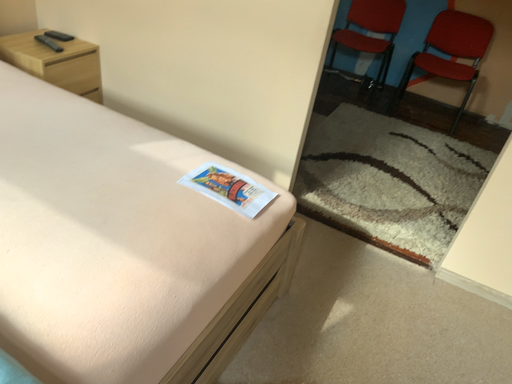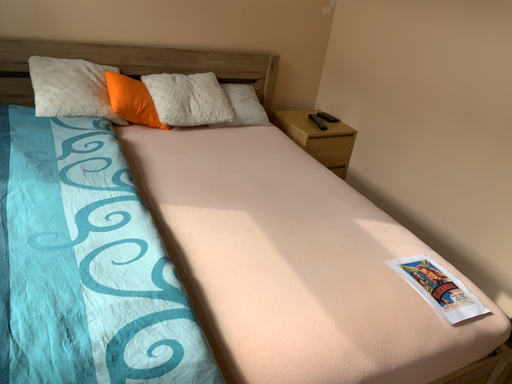
Question: Which way did the camera rotate in the video?

Choices:
 (A) rotated right
 (B) rotated left

Answer: (B)